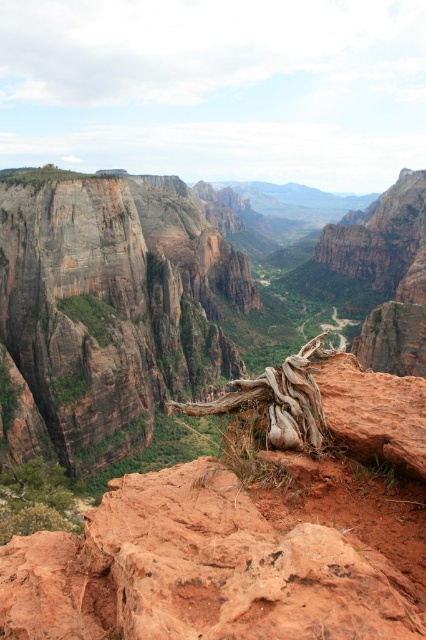
The width and height of the screenshot is (426, 640). Describe the element at coordinates (108, 310) in the screenshot. I see `rustic brown cliff at upper left` at that location.

Is point (34, 426) positioned before point (296, 400)?

No, it is not.

The height and width of the screenshot is (640, 426). In order to click on rustic brown cliff at upper left in this screenshot , I will do click(108, 310).

The image size is (426, 640). Find the location of `rustic brown cliff at upper left`. rustic brown cliff at upper left is located at coordinates (108, 310).

Can you confirm if rustic rock canyon at center is positioned to the right of rustic brown cliff at upper left?

Yes, rustic rock canyon at center is to the right of rustic brown cliff at upper left.

Find the location of a particular element. The image size is (426, 640). rustic rock canyon at center is located at coordinates (210, 419).

Who is taller, rustic rock canyon at center or brown rough tree root at center?

rustic rock canyon at center is taller.

Describe the element at coordinates (210, 419) in the screenshot. I see `rustic rock canyon at center` at that location.

Is point (420, 577) farther from camera compared to point (316, 413)?

No.

You are a GUI agent. You are given a task and a screenshot of the screen. Output one action in this format:
    pyautogui.click(x=<x>, y=<y>)
    Task: Click on the rustic rock canyon at center
    The image size is (426, 640).
    Given the screenshot: What is the action you would take?
    pyautogui.click(x=210, y=419)